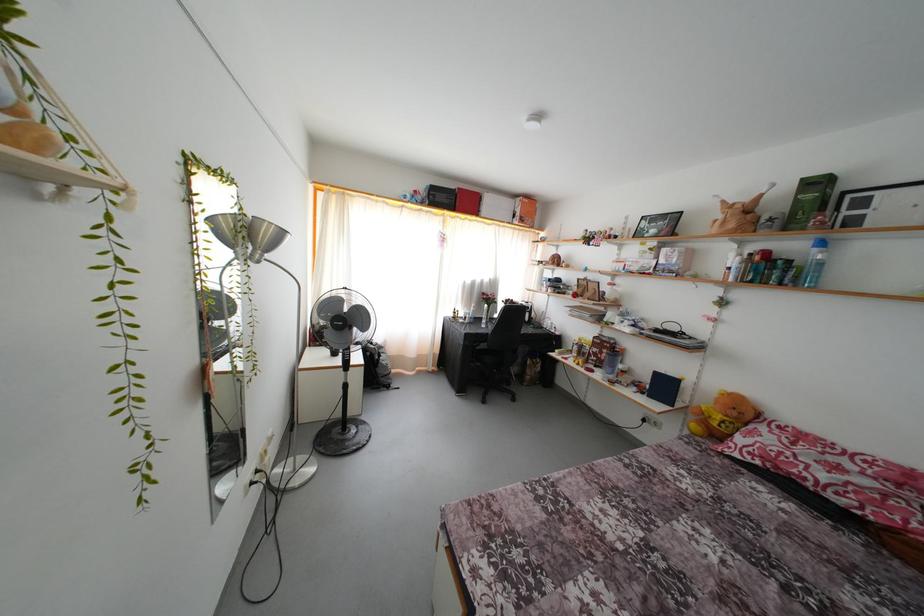
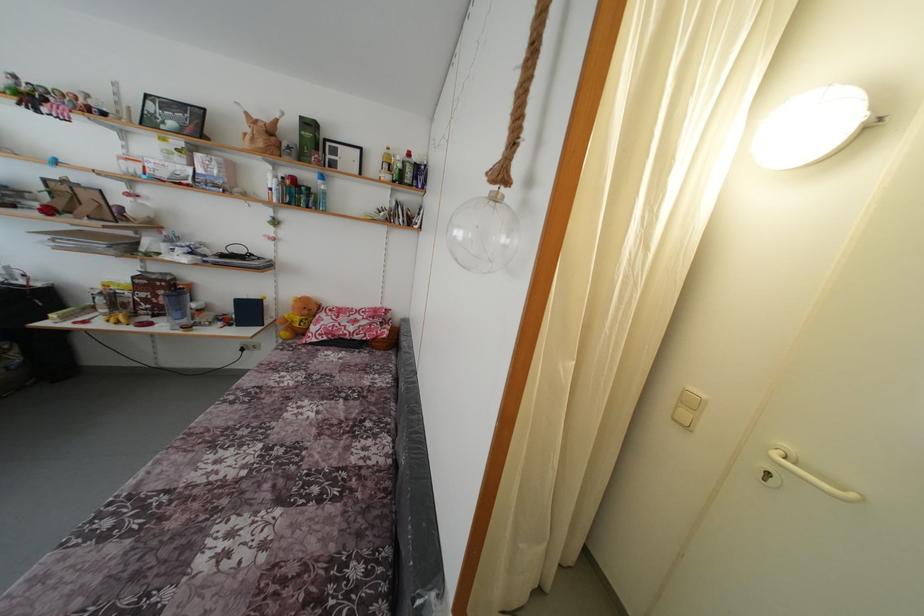
Locate, in the second image, the point that corresponds to pixel 585 359 in the first image.

(120, 310)